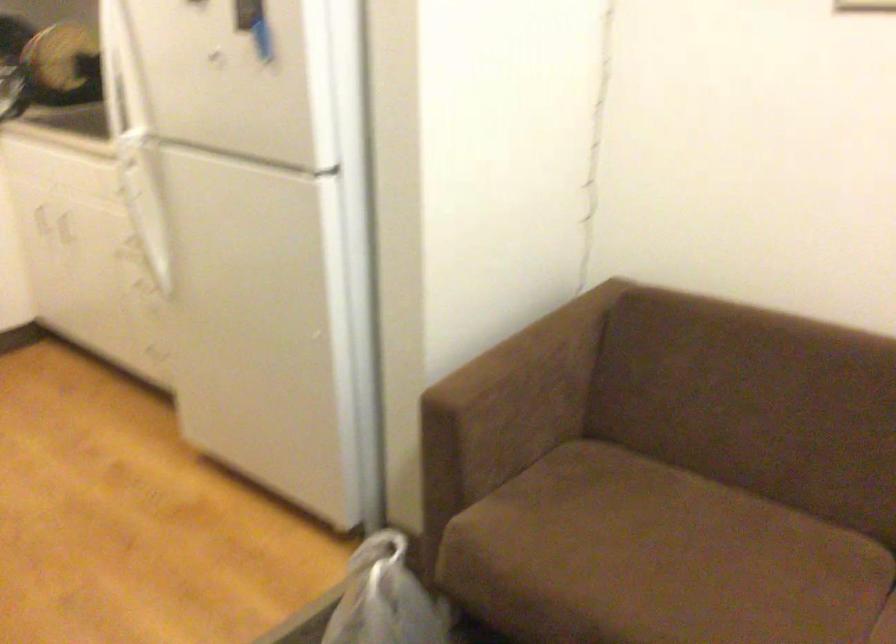
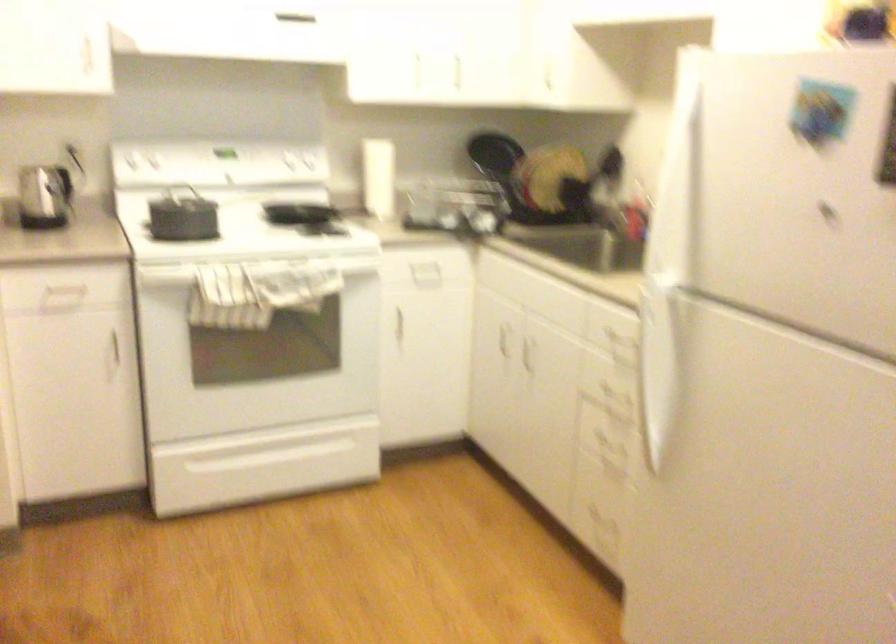
In a continuous first-person perspective shot, in which direction is the camera moving?

The cameraman moved toward left, forward.